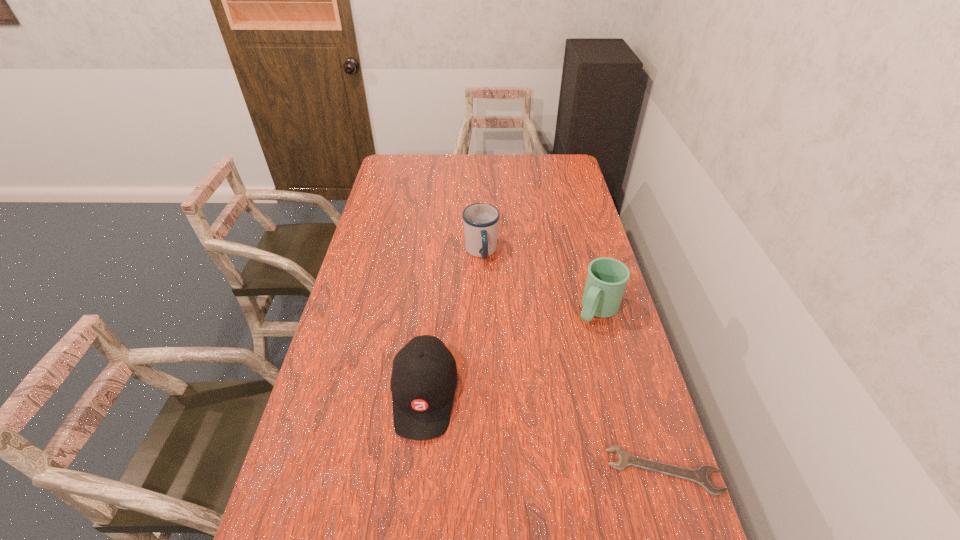
Identify the location of vacant region located on the handle side of the left mug. (491, 285).

The height and width of the screenshot is (540, 960). I want to click on vacant region located 0.210m on the handle side of the left mug, so click(498, 310).

Identify the location of free space located 0.350m on the side of the second farthest object with the handle. The height and width of the screenshot is (540, 960). (528, 404).

Locate an element on the screen. Image resolution: width=960 pixels, height=540 pixels. vacant space located 0.340m on the side of the second farthest object with the handle is located at coordinates (530, 401).

Identify the location of vacant space located on the side of the second farthest object with the handle. (561, 361).

Locate an element on the screen. This screenshot has width=960, height=540. wrench that is at the right edge is located at coordinates (701, 476).

Where is `mug present at the right edge`? The height and width of the screenshot is (540, 960). mug present at the right edge is located at coordinates (606, 280).

This screenshot has height=540, width=960. I want to click on free point at the far edge, so click(532, 159).

This screenshot has width=960, height=540. What are the coordinates of `free space at the near edge of the desktop` in the screenshot? It's located at (394, 500).

The width and height of the screenshot is (960, 540). Identify the location of vacant space at the right edge of the desktop. (575, 286).